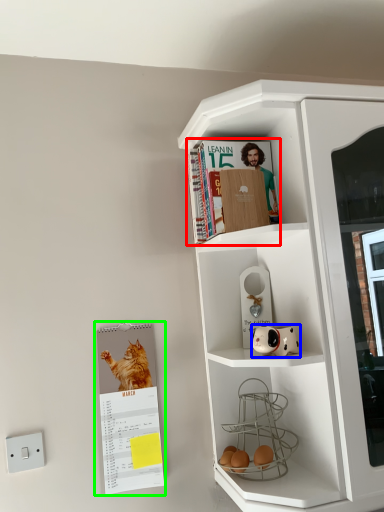
Question: Which is farther away from magazine (highlighted by a red box)? toy (highlighted by a blue box) or paperback book (highlighted by a green box)?

Choices:
 (A) toy
 (B) paperback book

Answer: (B)